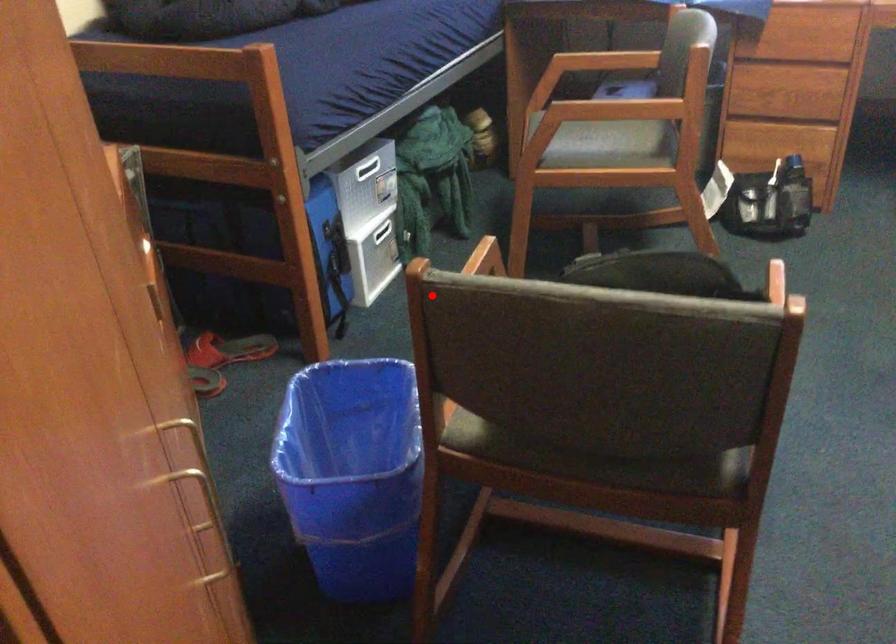
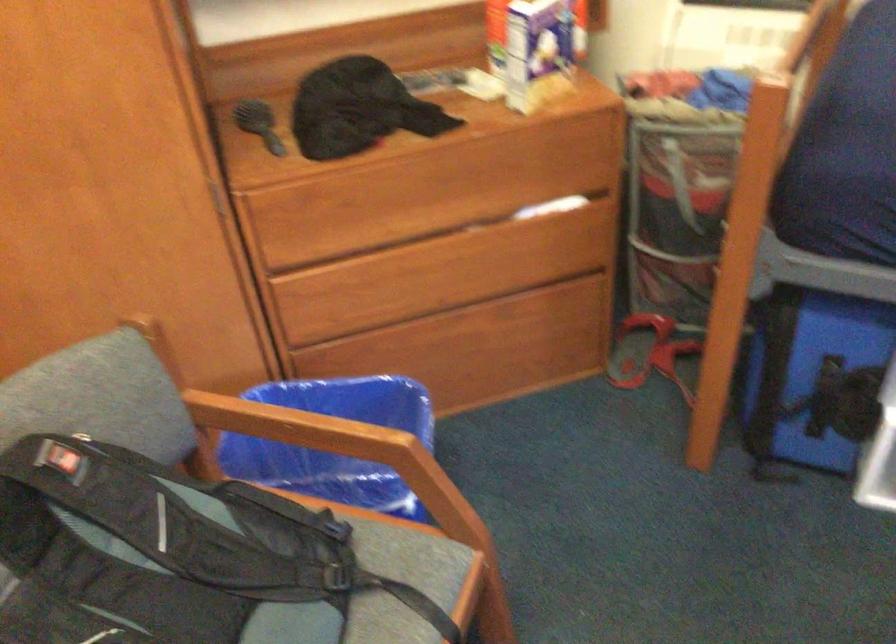
Locate, in the second image, the point that corresponds to the highlighted location in the first image.

(290, 424)